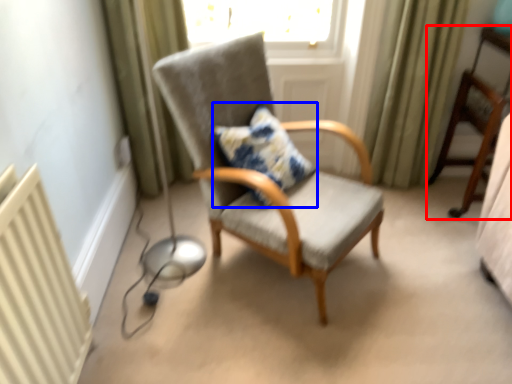
Question: Which object is further to the camera taking this photo, chair (highlighted by a red box) or pillow (highlighted by a blue box)?

Choices:
 (A) chair
 (B) pillow

Answer: (A)